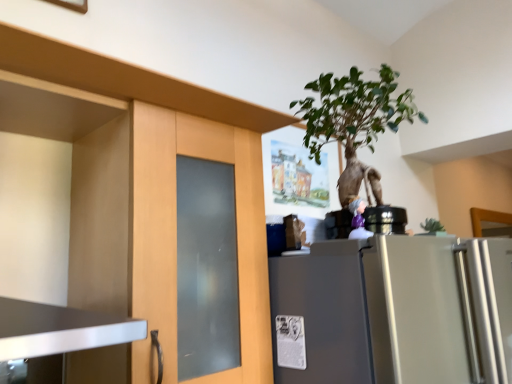
Question: Considering the positions of point (347, 82) and point (262, 278), is point (347, 82) closer or farther from the camera than point (262, 278)?

Choices:
 (A) closer
 (B) farther

Answer: (B)

Question: From a real-world perspective, is green leafy plant at upper center positioned above or below matte wood cabinet at left?

Choices:
 (A) above
 (B) below

Answer: (A)

Question: Estimate the real-world distances between objects in this image. Which object is closer to the matte wood cabinet at left?

Choices:
 (A) green leafy plant at upper center
 (B) satin silver refrigerator at right

Answer: (B)

Question: Which object is the farthest from the green leafy plant at upper center?

Choices:
 (A) satin silver refrigerator at right
 (B) matte wood cabinet at left

Answer: (A)